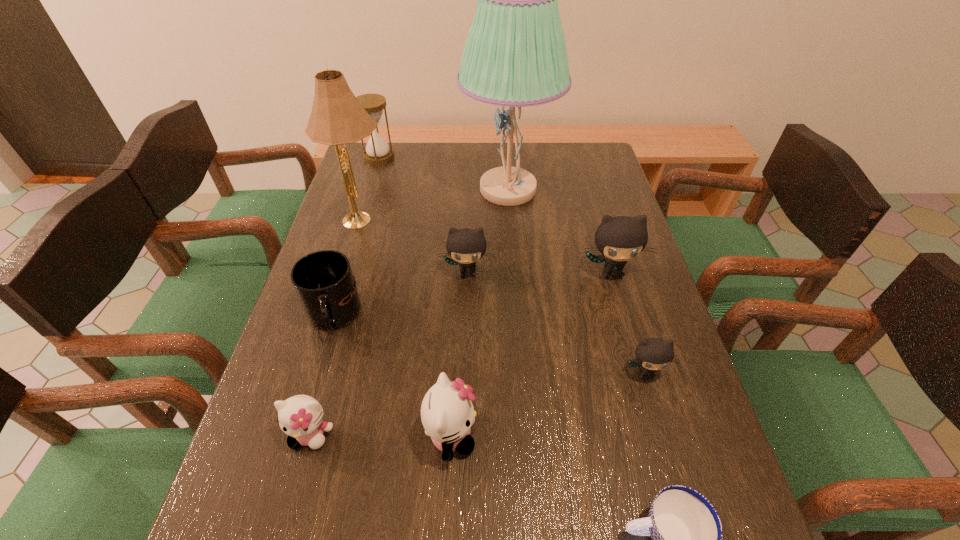
Find the location of `free point between the bigger white kitten and the leftmost gray kitten`. free point between the bigger white kitten and the leftmost gray kitten is located at coordinates (459, 354).

Where is `vacant area that lies between the white hourglass and the sixth farthest object`? The height and width of the screenshot is (540, 960). vacant area that lies between the white hourglass and the sixth farthest object is located at coordinates (356, 237).

The image size is (960, 540). In order to click on unoccupied area between the biggest gray kitten and the smaller white kitten in this screenshot , I will do `click(461, 353)`.

The height and width of the screenshot is (540, 960). What are the coordinates of `object that ranks as the eighth closest to the third nearest kitten` in the screenshot? It's located at (337, 117).

Locate an element on the screen. object that ranks as the third closest to the teal lamp is located at coordinates (337, 117).

Select which kitten is the third closest to the white hourglass. Please provide its 2D coordinates. Your answer should be formatted as a tuple, i.e. [(x, y)], where the tuple contains the x and y coordinates of a point satisfying the conditions above.

[(447, 413)]

Image resolution: width=960 pixels, height=540 pixels. I want to click on kitten that stands as the fourth closest to the teal lamp, so click(447, 413).

Point out which gray kitten is positioned as the second nearest to the biggest gray kitten. Please provide its 2D coordinates. Your answer should be formatted as a tuple, i.e. [(x, y)], where the tuple contains the x and y coordinates of a point satisfying the conditions above.

[(652, 354)]

Point out which gray kitten is positioned as the nearest to the second smallest gray kitten. Please provide its 2D coordinates. Your answer should be formatted as a tuple, i.e. [(x, y)], where the tuple contains the x and y coordinates of a point satisfying the conditions above.

[(619, 239)]

You are a GUI agent. You are given a task and a screenshot of the screen. Output one action in this format:
    pyautogui.click(x=<x>, y=<y>)
    Task: Click on the free location that satisfies the following two spatial constraints: 1. on the front-facing side of the biggest gray kitten; 2. on the front-facing side of the bigger white kitten
    
    Given the screenshot: What is the action you would take?
    pyautogui.click(x=658, y=435)